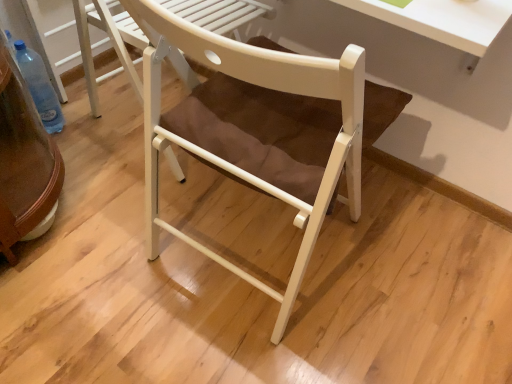
Identify the location of free space behind transparent plastic bottle at lower left. The image size is (512, 384). (83, 104).